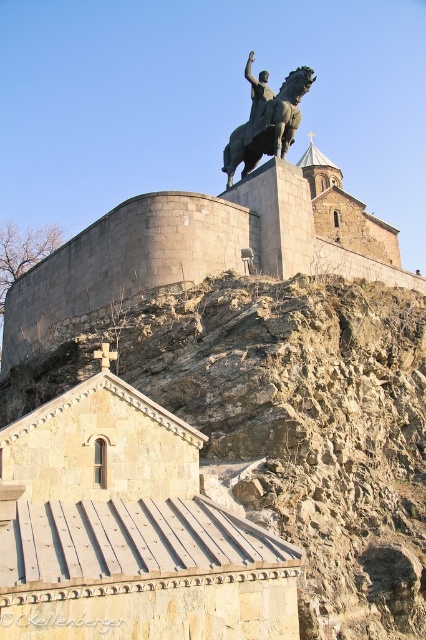
Which is more to the left, brown rocky hillside at upper center or bronze statue at upper center?

brown rocky hillside at upper center

Where is `brown rocky hillside at upper center`? The width and height of the screenshot is (426, 640). brown rocky hillside at upper center is located at coordinates (290, 422).